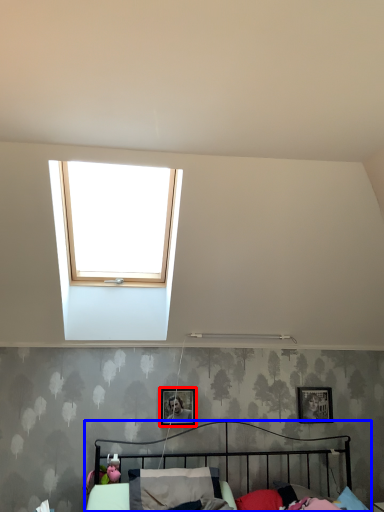
Question: Which of the following is the closest to the observer, picture frame (highlighted by a red box) or bed (highlighted by a blue box)?

Choices:
 (A) picture frame
 (B) bed

Answer: (B)